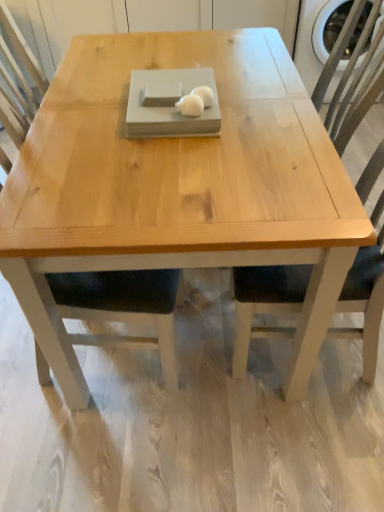
This screenshot has height=512, width=384. What do you see at coordinates (265, 303) in the screenshot? I see `natural wood chair at right` at bounding box center [265, 303].

What is the approximate width of natural wood chair at right?

natural wood chair at right is 23.92 inches wide.

This screenshot has height=512, width=384. Describe the element at coordinates (178, 186) in the screenshot. I see `natural wood coffee table at center` at that location.

Find the location of a particular element. The height and width of the screenshot is (512, 384). white matte eggs at center, marked as the second food in a left-to-right arrangement is located at coordinates (204, 95).

The height and width of the screenshot is (512, 384). I want to click on natural wood chair at right, so click(265, 303).

Can you confirm if natural wood chair at right is shorter than natural wood coffee table at center?

No.

What's the angular difference between natural wood chair at right and natural wood coffee table at center's facing directions?

The angular difference between natural wood chair at right and natural wood coffee table at center is 2.28 degrees.

In the scene shown: Considering their positions, is natural wood chair at right located in front of or behind natural wood coffee table at center?

Clearly, natural wood chair at right is in front of natural wood coffee table at center.

Where is `chair lying in front of the natural wood coffee table at center`? The image size is (384, 512). chair lying in front of the natural wood coffee table at center is located at coordinates (265, 303).

Considering the sizes of objects natural wood coffee table at center and white matte mouse at center, which appears as the 1th food when viewed from the left, in the image provided, who is bigger, natural wood coffee table at center or white matte mouse at center, which appears as the 1th food when viewed from the left,?

natural wood coffee table at center.

Measure the distance from natural wood coffee table at center to white matte mouse at center, which appears as the 1th food when viewed from the left.

A distance of 44.01 centimeters exists between natural wood coffee table at center and white matte mouse at center, which appears as the 1th food when viewed from the left.

Is point (38, 212) positioned behind point (188, 115)?

No.

Considering the sizes of objects natural wood coffee table at center and white matte mouse at center, placed as the second food when sorted from right to left, in the image provided, who is wider, natural wood coffee table at center or white matte mouse at center, placed as the second food when sorted from right to left,?

natural wood coffee table at center.

Does natural wood coffee table at center come behind natural wood chair at right?

Yes, the depth of natural wood coffee table at center is greater than that of natural wood chair at right.

Find the location of a particular element. Image resolution: width=384 pixels, height=512 pixels. chair in front of the natural wood coffee table at center is located at coordinates (265, 303).

Which of these two, natural wood coffee table at center or natural wood chair at right, is wider?

natural wood coffee table at center is wider.

Is natural wood coffee table at center shorter than natural wood chair at right?

Yes.

Considering the relative sizes of white matte mouse at center, which appears as the 1th food when viewed from the left, and natural wood coffee table at center in the image provided, is white matte mouse at center, which appears as the 1th food when viewed from the left, bigger than natural wood coffee table at center?

Actually, white matte mouse at center, which appears as the 1th food when viewed from the left, might be smaller than natural wood coffee table at center.

Considering the sizes of objects white matte mouse at center, placed as the second food when sorted from right to left, and natural wood coffee table at center in the image provided, who is shorter, white matte mouse at center, placed as the second food when sorted from right to left, or natural wood coffee table at center?

With less height is white matte mouse at center, placed as the second food when sorted from right to left.

Is point (189, 105) positioned behind point (76, 214)?

Yes, point (189, 105) is behind point (76, 214).

Is point (203, 88) farther from viewer compared to point (35, 140)?

Yes, it is behind point (35, 140).

Considering the positions of objects white matte eggs at center, marked as the second food in a left-to-right arrangement, and natural wood coffee table at center in the image provided, who is behind, white matte eggs at center, marked as the second food in a left-to-right arrangement, or natural wood coffee table at center?

natural wood coffee table at center is more distant.

Considering the sizes of objects white matte eggs at center, marked as the second food in a left-to-right arrangement, and natural wood coffee table at center in the image provided, who is shorter, white matte eggs at center, marked as the second food in a left-to-right arrangement, or natural wood coffee table at center?

white matte eggs at center, marked as the second food in a left-to-right arrangement.

Which object is positioned more to the left, white matte eggs at center, marked as the second food in a left-to-right arrangement, or natural wood coffee table at center?

natural wood coffee table at center is more to the left.

How far apart are white matte eggs at center, the first food from the right, and natural wood chair at right?

64.44 centimeters.

Can you confirm if white matte eggs at center, marked as the second food in a left-to-right arrangement, is wider than natural wood chair at right?

Incorrect, the width of white matte eggs at center, marked as the second food in a left-to-right arrangement, does not surpass that of natural wood chair at right.

From a real-world perspective, is white matte eggs at center, marked as the second food in a left-to-right arrangement, located higher than natural wood chair at right?

Indeed, from a real-world perspective, white matte eggs at center, marked as the second food in a left-to-right arrangement, stands above natural wood chair at right.

Between point (362, 196) and point (191, 111), which one is positioned in front?

The point (191, 111) is closer.

Do you think natural wood chair at right is within white matte mouse at center, which appears as the 1th food when viewed from the left, or outside of it?

natural wood chair at right is outside white matte mouse at center, which appears as the 1th food when viewed from the left.

From the image's perspective, is natural wood chair at right below white matte mouse at center, which appears as the 1th food when viewed from the left?

Indeed, from the image's perspective, natural wood chair at right is shown beneath white matte mouse at center, which appears as the 1th food when viewed from the left.

Is natural wood chair at right not near white matte mouse at center, which appears as the 1th food when viewed from the left?

No, natural wood chair at right is not far away from white matte mouse at center, which appears as the 1th food when viewed from the left.

Identify the location of coffee table lying on the left of natural wood chair at right. (178, 186).

Locate an element on the screen. the 2nd food directly above the natural wood coffee table at center (from a real-world perspective) is located at coordinates (190, 105).

Estimate the real-world distances between objects in this image. Which object is closer to white matte eggs at center, the first food from the right, natural wood chair at right or white matte mouse at center, placed as the second food when sorted from right to left?

white matte mouse at center, placed as the second food when sorted from right to left, is positioned closer to the anchor white matte eggs at center, the first food from the right.

Which object lies nearer to the anchor point natural wood chair at right, white matte mouse at center, which appears as the 1th food when viewed from the left, or natural wood coffee table at center?

natural wood coffee table at center is positioned closer to the anchor natural wood chair at right.

Looking at the image, which one is located closer to white matte eggs at center, the first food from the right, natural wood chair at right or natural wood coffee table at center?

natural wood coffee table at center is positioned closer to the anchor white matte eggs at center, the first food from the right.

Based on their spatial positions, is natural wood coffee table at center or natural wood chair at right further from white matte mouse at center, placed as the second food when sorted from right to left?

natural wood chair at right.

Estimate the real-world distances between objects in this image. Which object is further from white matte mouse at center, which appears as the 1th food when viewed from the left, white matte eggs at center, marked as the second food in a left-to-right arrangement, or natural wood coffee table at center?

Based on the image, natural wood coffee table at center appears to be further to white matte mouse at center, which appears as the 1th food when viewed from the left.

From the image, which object appears to be nearer to natural wood chair at right, natural wood coffee table at center or white matte eggs at center, the first food from the right?

natural wood coffee table at center.

Estimate the real-world distances between objects in this image. Which object is closer to white matte mouse at center, which appears as the 1th food when viewed from the left, natural wood coffee table at center or white matte eggs at center, the first food from the right?

The object closer to white matte mouse at center, which appears as the 1th food when viewed from the left, is white matte eggs at center, the first food from the right.

Looking at the image, which one is located closer to natural wood coffee table at center, white matte mouse at center, placed as the second food when sorted from right to left, or white matte eggs at center, marked as the second food in a left-to-right arrangement?

white matte eggs at center, marked as the second food in a left-to-right arrangement.

Where is `food that lies between white matte eggs at center, marked as the second food in a left-to-right arrangement, and natural wood coffee table at center from top to bottom`? The height and width of the screenshot is (512, 384). food that lies between white matte eggs at center, marked as the second food in a left-to-right arrangement, and natural wood coffee table at center from top to bottom is located at coordinates (190, 105).

Locate an element on the screen. Image resolution: width=384 pixels, height=512 pixels. food between natural wood chair at right and white matte eggs at center, the first food from the right, in the front-back direction is located at coordinates (190, 105).